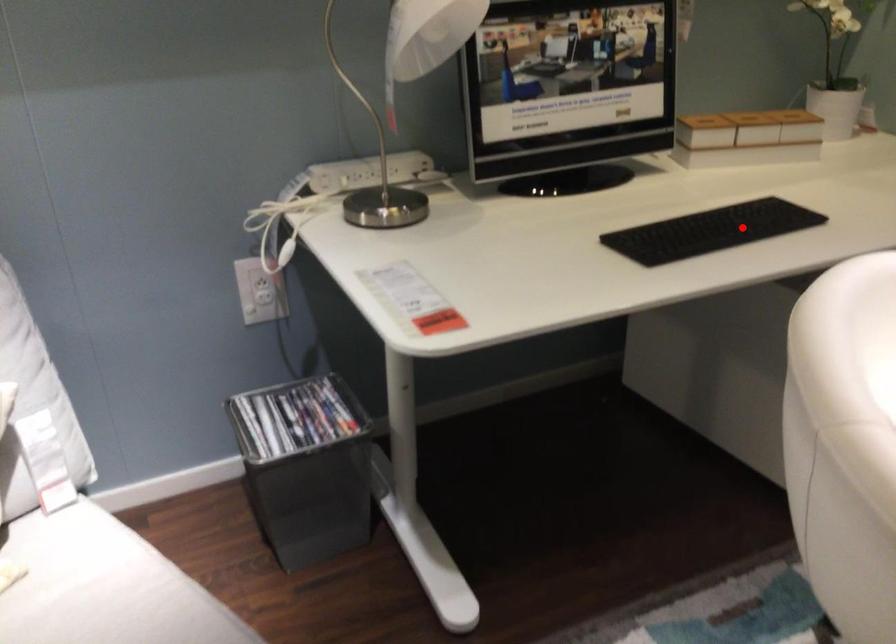
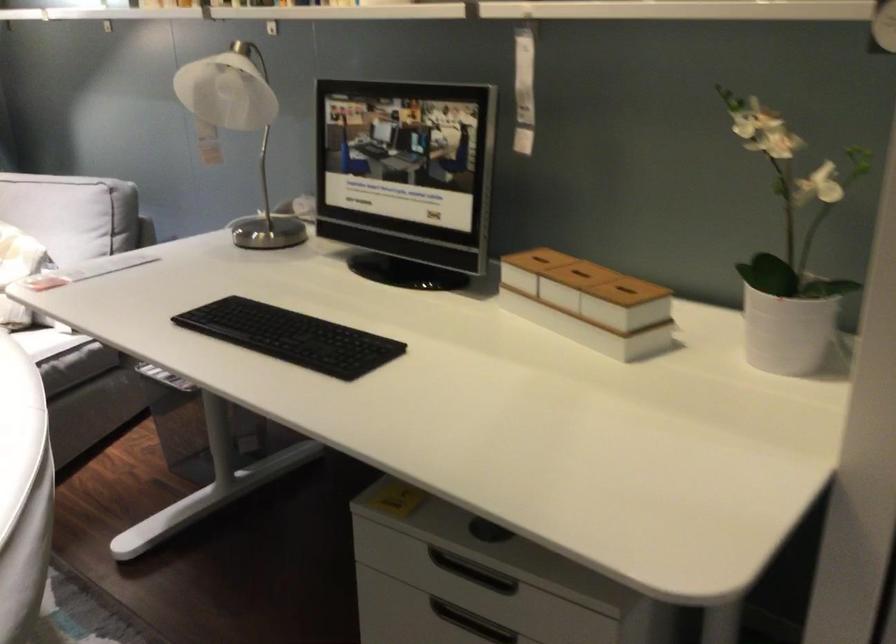
Question: I am providing you with two images of the same scene from different viewpoints. Image1 has a red point marked. In image2, the corresponding 3D location appears at what relative position? Reply with the corresponding letter.

Choices:
 (A) Closer
 (B) Farther

Answer: (A)